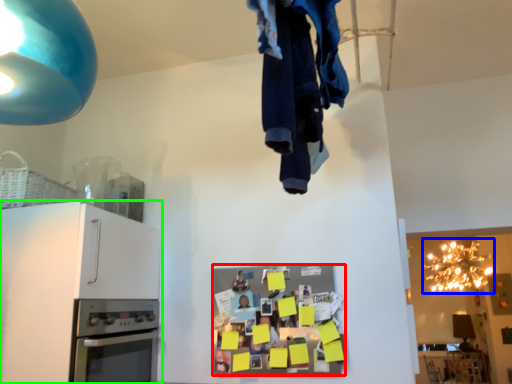
Question: Which object is positioned farthest from appliance (highlighted by a red box)? Select from lamp (highlighted by a blue box) and cabinetry (highlighted by a green box).

Choices:
 (A) lamp
 (B) cabinetry

Answer: (A)